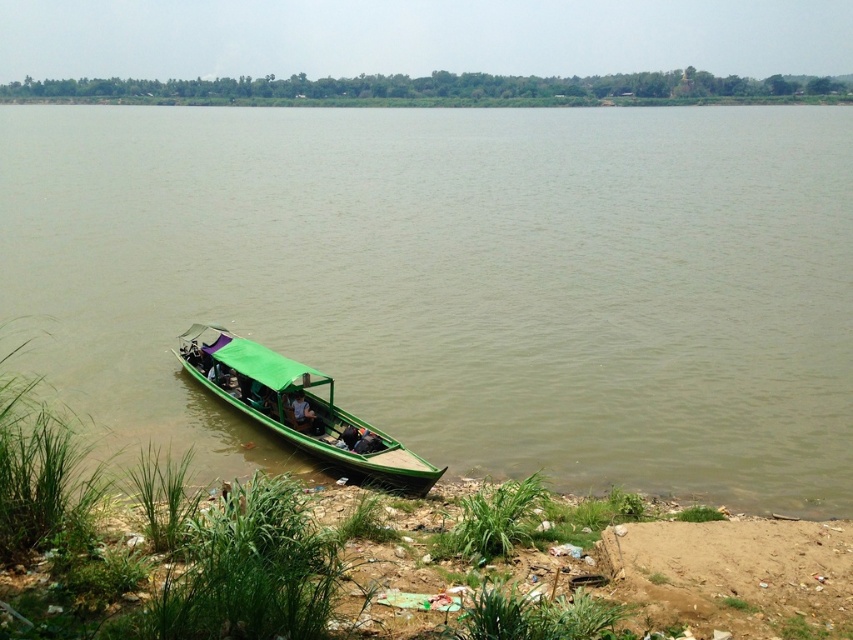
Question: Does green matte boat at lower center come in front of green fabric person at center?

Choices:
 (A) no
 (B) yes

Answer: (B)

Question: Where is green wooden boat at lower left located in relation to green matte boat at lower center in the image?

Choices:
 (A) right
 (B) left

Answer: (A)

Question: Can you confirm if green matte boat at lower center is positioned to the right of green fabric person at center?

Choices:
 (A) yes
 (B) no

Answer: (B)

Question: Among these points, which one is farthest from the camera?

Choices:
 (A) (561, 253)
 (B) (233, 385)
 (C) (296, 394)

Answer: (A)

Question: Among these points, which one is nearest to the camera?

Choices:
 (A) (26, 161)
 (B) (364, 432)

Answer: (B)

Question: Which of these objects is positioned farthest from the green matte boat at lower center?

Choices:
 (A) green wooden boat at lower left
 (B) green fabric person at center

Answer: (A)